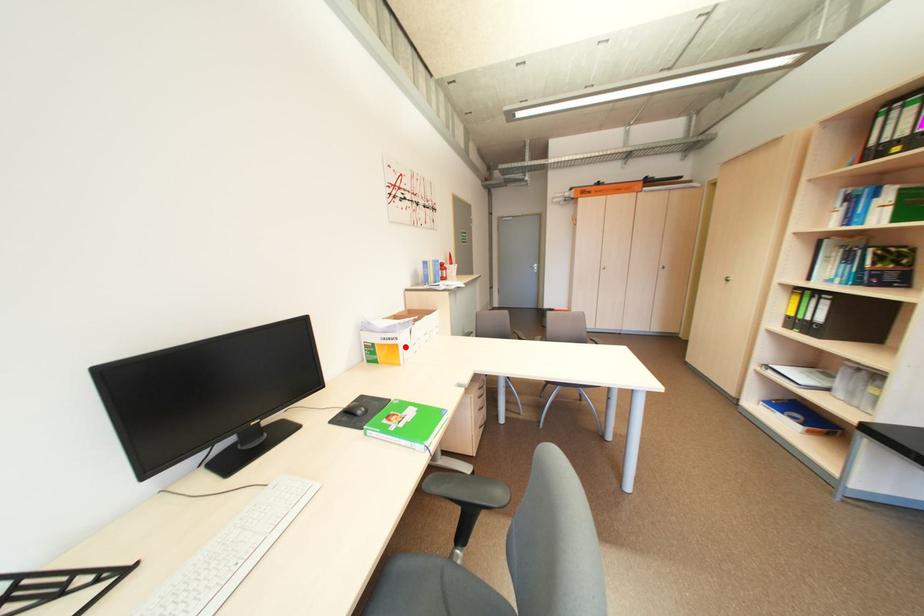
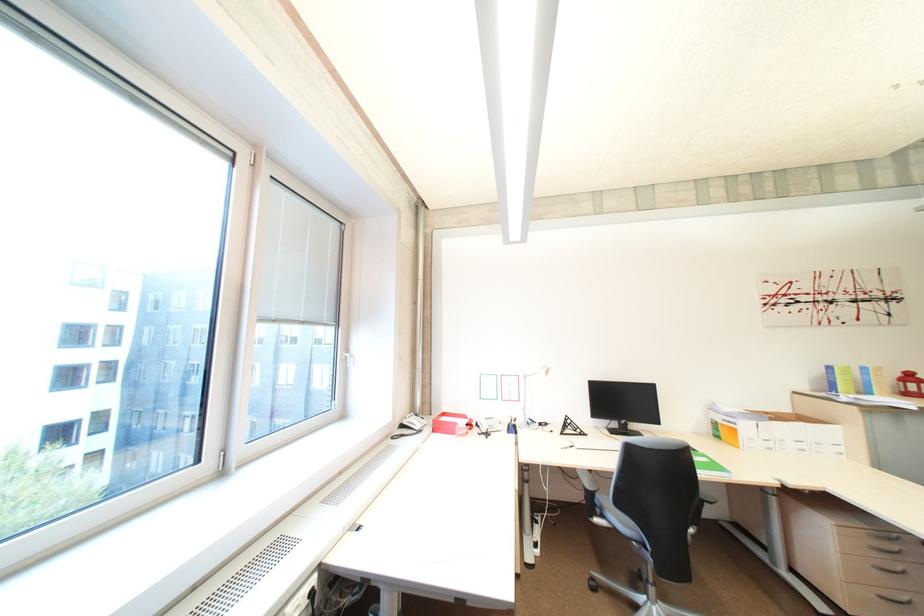
The point at the highlighted location is marked in the first image. Where is the corresponding point in the second image?

(745, 431)